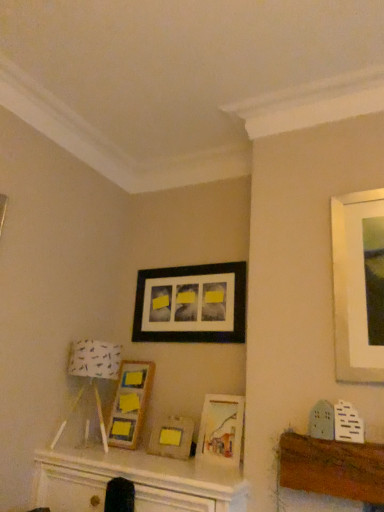
Question: Is matte wooden picture frame at center, the second picture frame from the bottom, facing towards black matte picture frame at upper center, which ranks as the 1th picture frame in top-to-bottom order?

Choices:
 (A) no
 (B) yes

Answer: (A)

Question: Is the position of matte wooden picture frame at center, which is counted as the third picture frame, starting from the top, less distant than that of black matte picture frame at upper center, which ranks as the 4th picture frame in bottom-to-top order?

Choices:
 (A) yes
 (B) no

Answer: (A)

Question: Is matte wooden picture frame at center, which is counted as the third picture frame, starting from the top, smaller than black matte picture frame at upper center, which ranks as the 4th picture frame in bottom-to-top order?

Choices:
 (A) yes
 (B) no

Answer: (A)

Question: Is matte wooden picture frame at center, the second picture frame from the bottom, further to the viewer compared to black matte picture frame at upper center, which ranks as the 1th picture frame in top-to-bottom order?

Choices:
 (A) yes
 (B) no

Answer: (B)

Question: From a real-world perspective, is matte wooden picture frame at center, the second picture frame from the bottom, on top of black matte picture frame at upper center, which ranks as the 1th picture frame in top-to-bottom order?

Choices:
 (A) no
 (B) yes

Answer: (A)

Question: From the image's perspective, relative to matte wooden picture frame at center, which is counted as the third picture frame, starting from the top, is white fabric lampshade at left above or below?

Choices:
 (A) above
 (B) below

Answer: (A)

Question: In the image, is white fabric lampshade at left on the left side or the right side of matte wooden picture frame at center, the second picture frame from the bottom?

Choices:
 (A) left
 (B) right

Answer: (A)

Question: From a real-world perspective, is white fabric lampshade at left above or below matte wooden picture frame at center, the second picture frame from the bottom?

Choices:
 (A) above
 (B) below

Answer: (A)

Question: In terms of size, does white fabric lampshade at left appear bigger or smaller than matte wooden picture frame at center, which is counted as the third picture frame, starting from the top?

Choices:
 (A) small
 (B) big

Answer: (B)

Question: Based on their positions, is black matte picture frame at upper center, which ranks as the 4th picture frame in bottom-to-top order, located to the left or right of matte wooden picture frame at center, the second picture frame from the bottom?

Choices:
 (A) right
 (B) left

Answer: (B)

Question: In terms of height, does black matte picture frame at upper center, which ranks as the 1th picture frame in top-to-bottom order, look taller or shorter compared to matte wooden picture frame at center, the second picture frame from the bottom?

Choices:
 (A) tall
 (B) short

Answer: (A)

Question: From the image's perspective, is black matte picture frame at upper center, which ranks as the 1th picture frame in top-to-bottom order, above or below matte wooden picture frame at center, which is counted as the third picture frame, starting from the top?

Choices:
 (A) above
 (B) below

Answer: (A)

Question: From a real-world perspective, relative to matte wooden picture frame at center, the second picture frame from the bottom, is black matte picture frame at upper center, which ranks as the 1th picture frame in top-to-bottom order, vertically above or below?

Choices:
 (A) below
 (B) above

Answer: (B)

Question: Considering the positions of white fabric lampshade at left and wooden frame at center, the second picture frame positioned from the top, in the image, is white fabric lampshade at left bigger or smaller than wooden frame at center, the second picture frame positioned from the top,?

Choices:
 (A) big
 (B) small

Answer: (A)

Question: Considering the positions of white fabric lampshade at left and wooden frame at center, the third picture frame from the bottom, in the image, is white fabric lampshade at left wider or thinner than wooden frame at center, the third picture frame from the bottom,?

Choices:
 (A) thin
 (B) wide

Answer: (B)